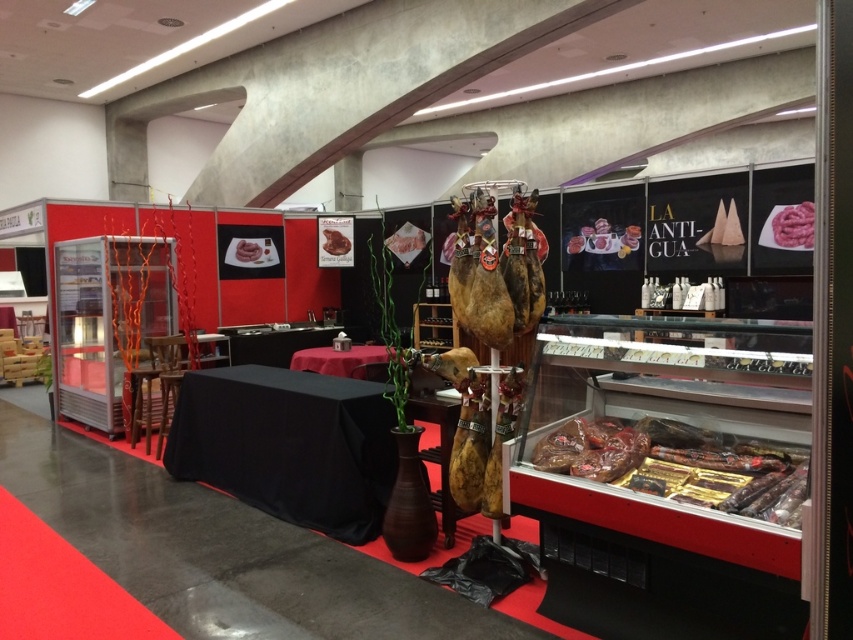
Question: Among these objects, which one is nearest to the camera?

Choices:
 (A) raw pink meat at center
 (B) pink glossy meat at center
 (C) black fabric table at center

Answer: (C)

Question: Is pink raw meat at upper right to the right of raw pink meat at center from the viewer's perspective?

Choices:
 (A) yes
 (B) no

Answer: (A)

Question: Can you confirm if raw pink meat at center is positioned below smooth brown meat at center?

Choices:
 (A) yes
 (B) no

Answer: (A)

Question: Which of these objects is positioned closest to the black fabric table at center?

Choices:
 (A) raw pink meat at center
 (B) pink glossy meat at center
 (C) shiny brown sausages at right

Answer: (C)

Question: Which point is closer to the camera?

Choices:
 (A) black fabric table at center
 (B) shiny brown sausages at right

Answer: (B)

Question: Does pink raw meat at upper right appear on the right side of raw pink meat at center?

Choices:
 (A) no
 (B) yes

Answer: (B)